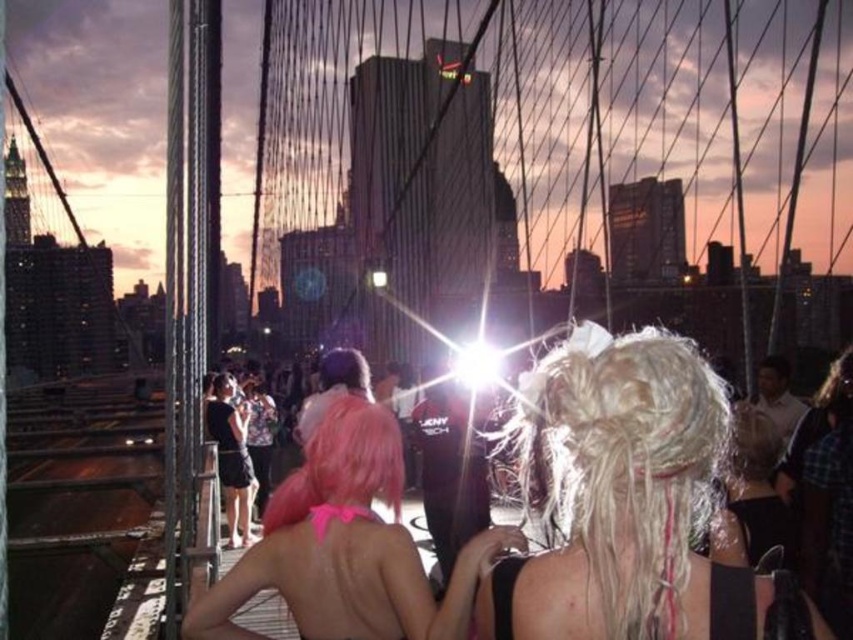
Question: Does pink matte wig at center have a lesser width compared to pink matte hair at center?

Choices:
 (A) no
 (B) yes

Answer: (A)

Question: Which point is farther from the camera taking this photo?

Choices:
 (A) (274, 545)
 (B) (590, 541)

Answer: (A)

Question: Which of the following is the closest to the observer?

Choices:
 (A) click(x=822, y=632)
 (B) click(x=399, y=490)

Answer: (A)

Question: Which point is farther from the camera taking this photo?

Choices:
 (A) (344, 413)
 (B) (372, 483)
 (C) (592, 582)

Answer: (A)

Question: Does blonde hair at center appear over pink matte wig at center?

Choices:
 (A) yes
 (B) no

Answer: (A)

Question: Does blonde hair at center have a larger size compared to pink matte wig at center?

Choices:
 (A) yes
 (B) no

Answer: (A)